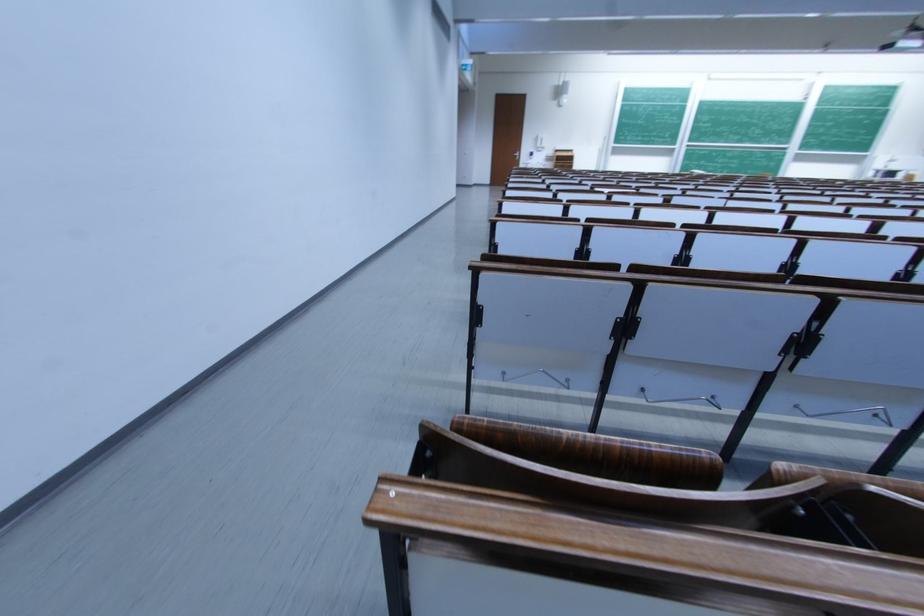
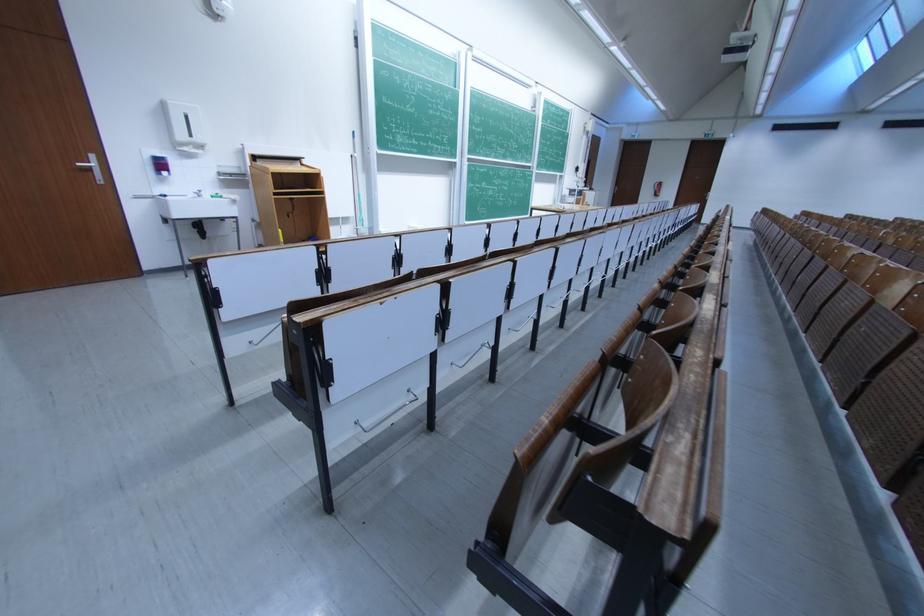
Locate, in the second image, the point that corresponds to (552,148) in the first image.

(205, 142)